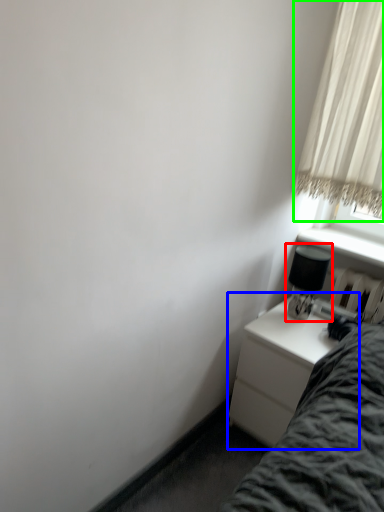
Question: Which object is the closest to the table lamp (highlighted by a red box)? Choose among these: nightstand (highlighted by a blue box) or curtain (highlighted by a green box).

Choices:
 (A) nightstand
 (B) curtain

Answer: (A)